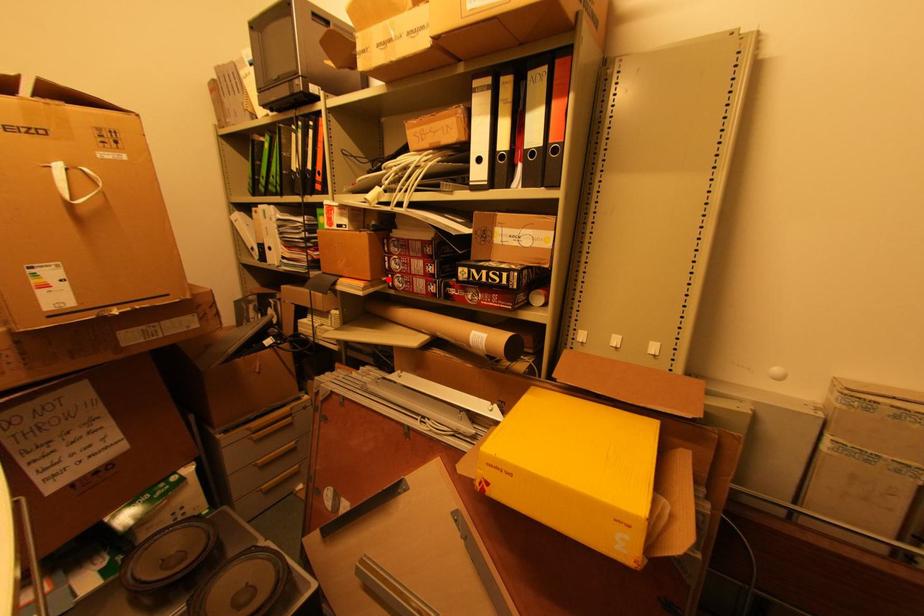
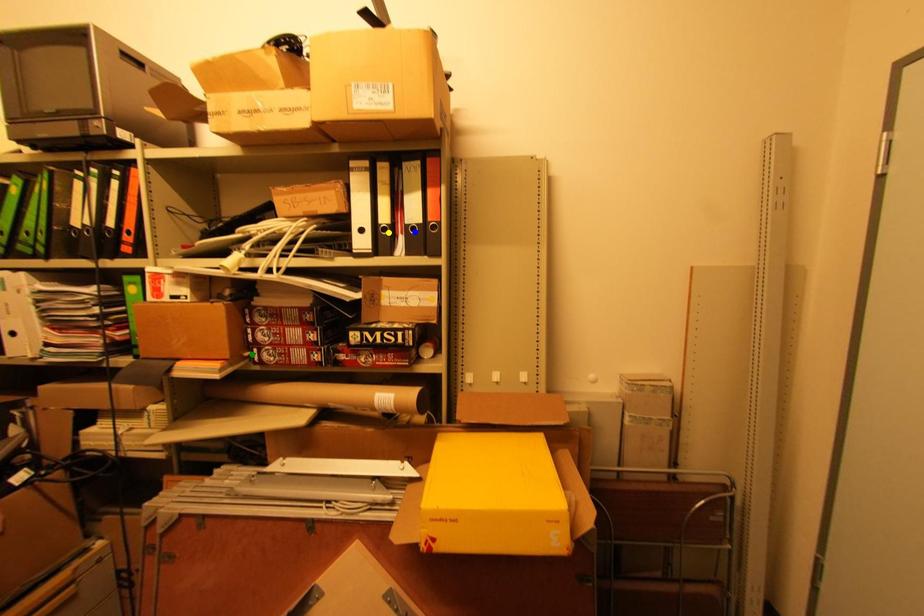
Question: I am providing you with two images of the same scene from different viewpoints. A red point is marked on the first image. You are given multiple points on the second image. Can you choose the point in image 2 that corresponds to the point in image 1?

Choices:
 (A) yellow point
 (B) green point
 (C) blue point

Answer: (B)